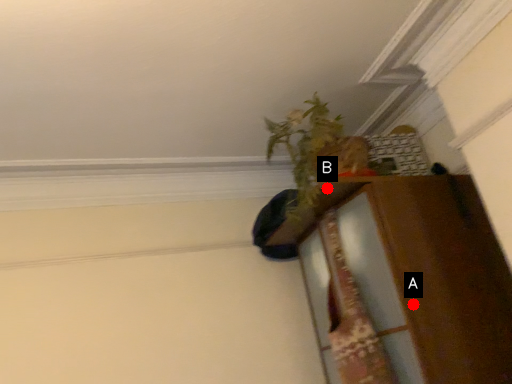
Question: Two points are circled on the image, labeled by A and B beside each circle. Among these points, which one is farthest from the camera?

Choices:
 (A) A is further
 (B) B is further

Answer: (B)